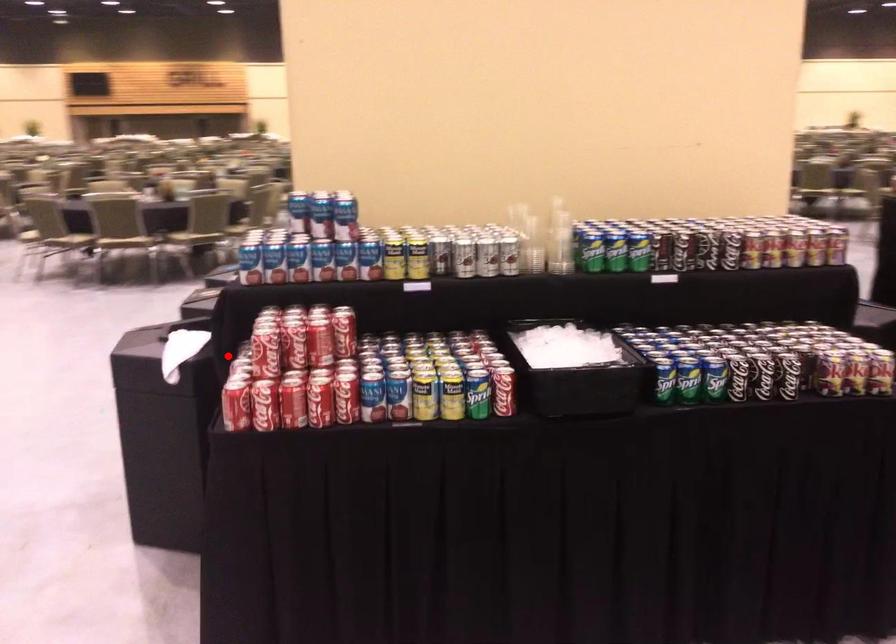
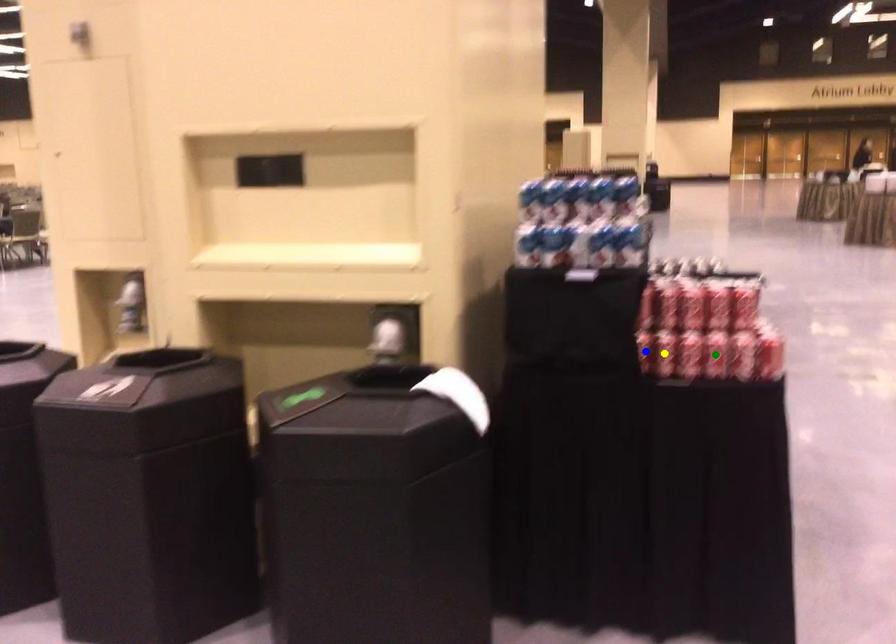
Question: I am providing you with two images of the same scene from different viewpoints. A red point is marked on the first image. You are given multiple points on the second image. Can you choose the point in image 2 that corresponds to the point in image 1?

Choices:
 (A) green point
 (B) yellow point
 (C) blue point

Answer: (C)